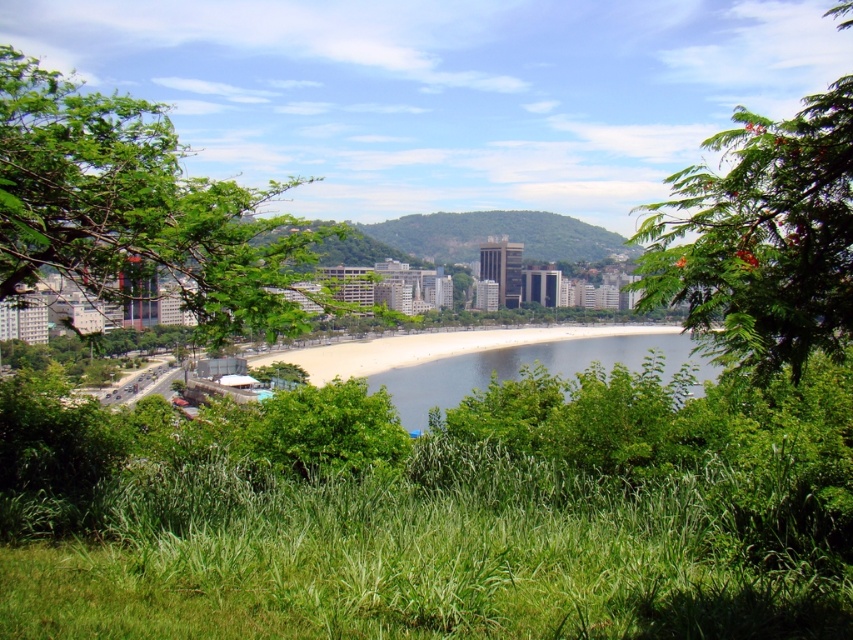
You are standing on the grassy hillside and want to take a photo of the green leafy tree at upper right without the green grass at lower center blocking the view. Which direction should you move to achieve this?

Move to the right so that the green grass at lower center is no longer blocking the view of the green leafy tree at upper right.